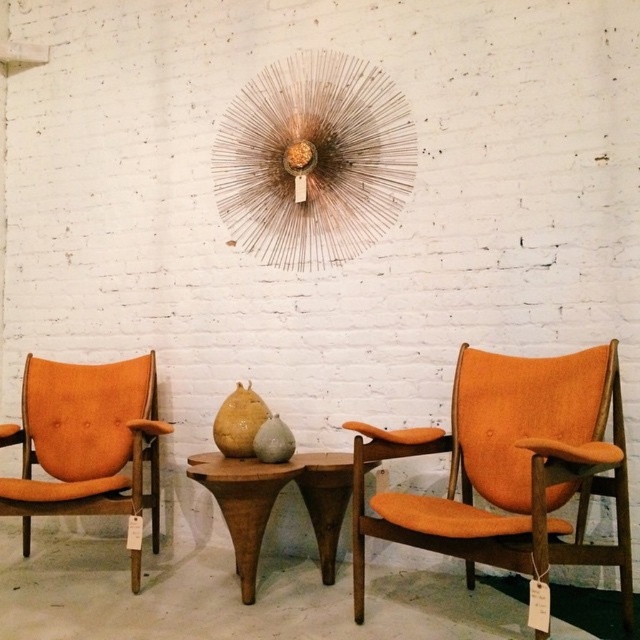
You are standing in the minimalist interior setting looking at the white brick wall with the starburst decoration. There are two points marked on the floor in front of the wall. One is at coordinate point (88,506) and the other at point (237,461). Which of these two points is closer to you as you face the wall?

Point (88,506) is closer to you because it is in front of point (237,461).

You are sitting in the orange fabric armchair at left and want to move to the orange fabric armchair at right. Which direction should you face to walk towards it?

You should face to the right because the orange fabric armchair at right is located to the right of the orange fabric armchair at left.

You are a guest entering the room and want to sit down comfortably. Considering the orange fabric armchair at right and the wooden table at center, which one is taller and thus might require more effort to sit on?

The orange fabric armchair at right is taller than the wooden table at center, so it might require more effort to sit on.